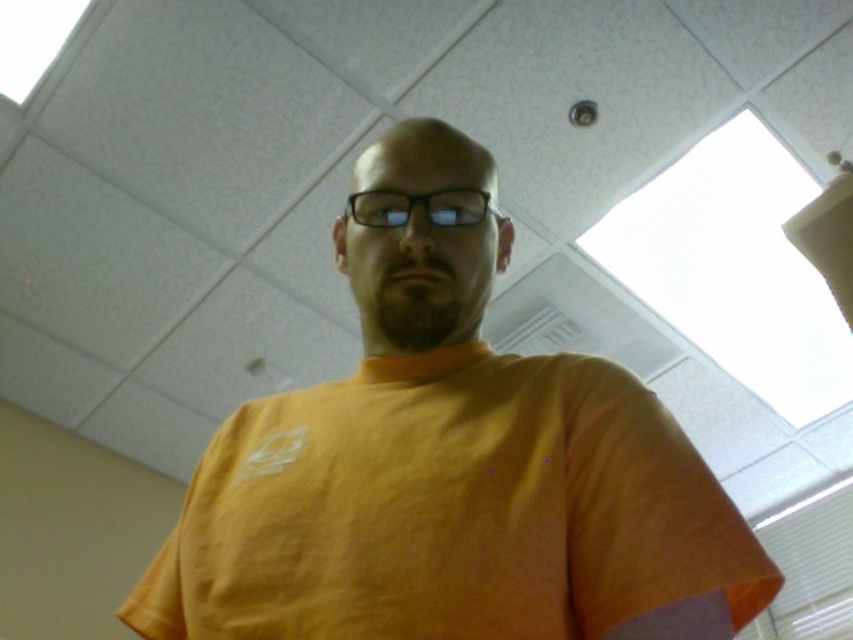
Question: Which object appears farthest from the camera in this image?

Choices:
 (A) transparent plastic glasses at center
 (B) orange t-shirt at center

Answer: (A)

Question: Is orange t-shirt at center closer to camera compared to transparent plastic glasses at center?

Choices:
 (A) yes
 (B) no

Answer: (A)

Question: Is orange t-shirt at center to the left of transparent plastic glasses at center from the viewer's perspective?

Choices:
 (A) no
 (B) yes

Answer: (B)

Question: Can you confirm if orange t-shirt at center is thinner than transparent plastic glasses at center?

Choices:
 (A) no
 (B) yes

Answer: (A)

Question: Which object appears closest to the camera in this image?

Choices:
 (A) orange t-shirt at center
 (B) transparent plastic glasses at center

Answer: (A)